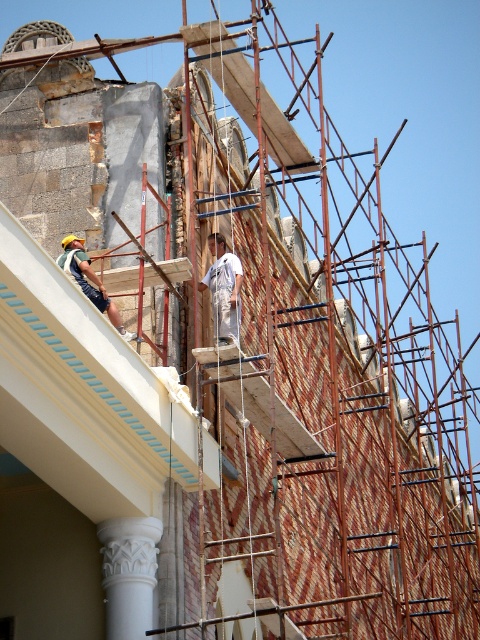
Question: Observing the image, what is the correct spatial positioning of white carved column at lower left in reference to green fabric construction worker at left?

Choices:
 (A) left
 (B) right

Answer: (B)

Question: Can you confirm if white cotton shirt at center is smaller than green fabric construction worker at left?

Choices:
 (A) yes
 (B) no

Answer: (A)

Question: Which point is farther to the camera?

Choices:
 (A) green fabric construction worker at left
 (B) white cotton shirt at center
 (C) white carved column at lower left

Answer: (B)

Question: Is white cotton shirt at center further to the viewer compared to green fabric construction worker at left?

Choices:
 (A) no
 (B) yes

Answer: (B)

Question: Which point is farther to the camera?

Choices:
 (A) green fabric construction worker at left
 (B) white carved column at lower left

Answer: (A)

Question: Which object is the farthest from the white carved column at lower left?

Choices:
 (A) white cotton shirt at center
 (B) green fabric construction worker at left

Answer: (A)